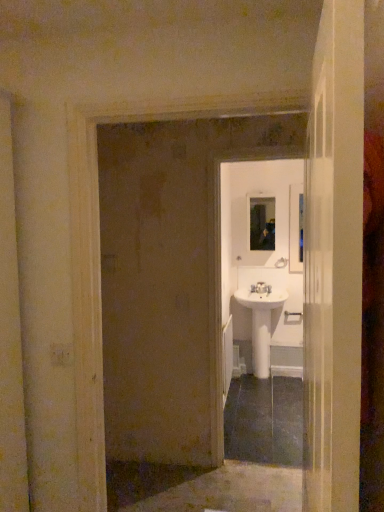
Question: From a real-world perspective, is white plastic light switch at lower left positioned under metallic reflective mirror at center based on gravity?

Choices:
 (A) no
 (B) yes

Answer: (B)

Question: Can we say white plastic light switch at lower left lies outside metallic reflective mirror at center?

Choices:
 (A) no
 (B) yes

Answer: (B)

Question: Is white plastic light switch at lower left bigger than metallic reflective mirror at center?

Choices:
 (A) yes
 (B) no

Answer: (B)

Question: Considering the relative sizes of white plastic light switch at lower left and metallic reflective mirror at center in the image provided, is white plastic light switch at lower left thinner than metallic reflective mirror at center?

Choices:
 (A) yes
 (B) no

Answer: (A)

Question: Is white plastic light switch at lower left positioned with its back to metallic reflective mirror at center?

Choices:
 (A) no
 (B) yes

Answer: (B)

Question: Considering the positions of point (56, 364) and point (236, 358), is point (56, 364) closer or farther from the camera than point (236, 358)?

Choices:
 (A) closer
 (B) farther

Answer: (A)

Question: Is white plastic light switch at lower left wider or thinner than white glossy sink at center?

Choices:
 (A) thin
 (B) wide

Answer: (A)

Question: From their relative heights in the image, would you say white plastic light switch at lower left is taller or shorter than white glossy sink at center?

Choices:
 (A) tall
 (B) short

Answer: (B)

Question: Is white plastic light switch at lower left bigger or smaller than white glossy sink at center?

Choices:
 (A) small
 (B) big

Answer: (A)

Question: Would you say white glossy sink at center is to the left or to the right of white glossy door at center in the picture?

Choices:
 (A) right
 (B) left

Answer: (A)

Question: Considering the positions of white glossy sink at center and white glossy door at center in the image, is white glossy sink at center taller or shorter than white glossy door at center?

Choices:
 (A) short
 (B) tall

Answer: (B)

Question: From a real-world perspective, is white glossy sink at center above or below white glossy door at center?

Choices:
 (A) above
 (B) below

Answer: (B)

Question: Looking at their shapes, would you say white glossy sink at center is wider or thinner than white glossy door at center?

Choices:
 (A) wide
 (B) thin

Answer: (B)

Question: From a real-world perspective, is white glossy door at center positioned above or below silver metallic door handle at center?

Choices:
 (A) below
 (B) above

Answer: (B)

Question: From the image's perspective, is white glossy door at center located above or below silver metallic door handle at center?

Choices:
 (A) above
 (B) below

Answer: (A)